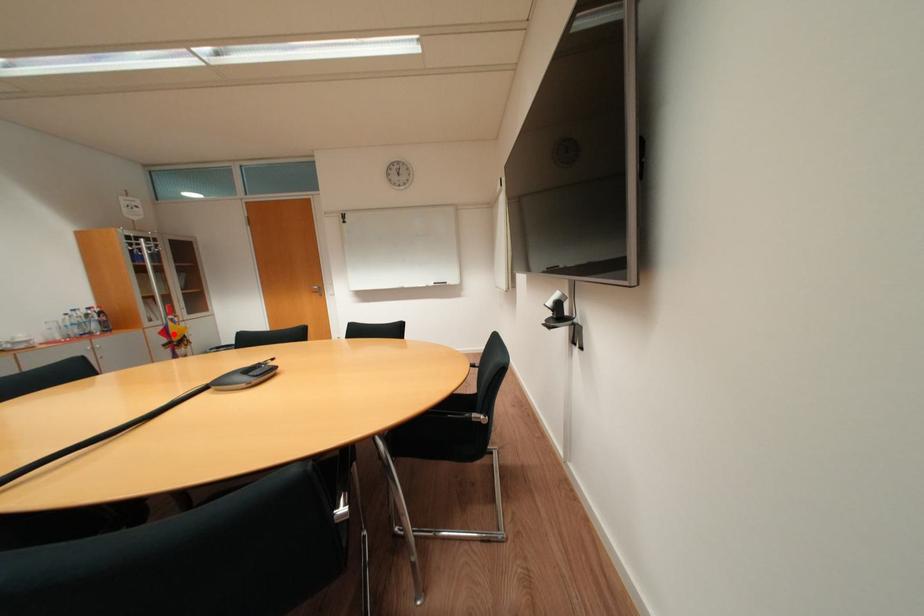
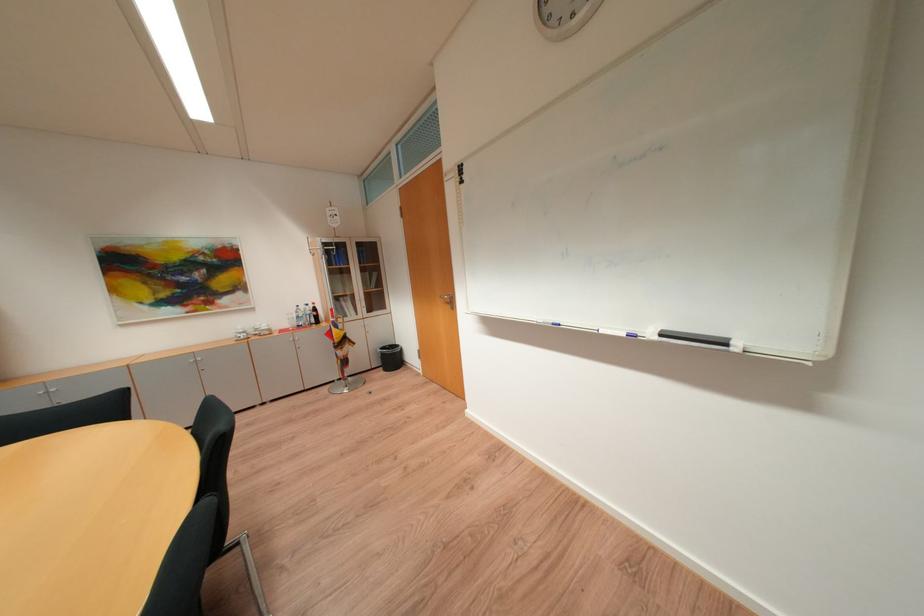
Locate, in the second image, the point that corresponds to the highlighted location in the first image.

(338, 334)